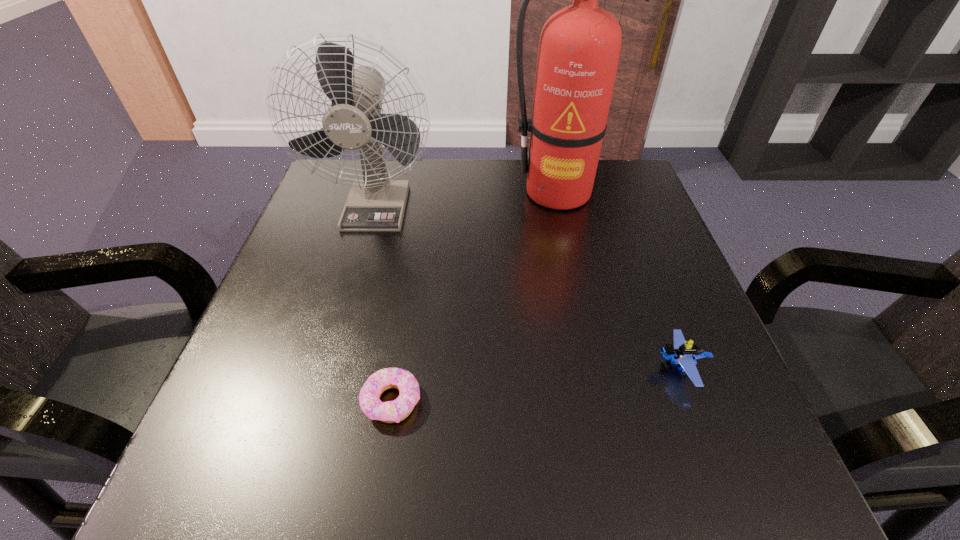
Where is `fire extinguisher`? The image size is (960, 540). fire extinguisher is located at coordinates (579, 48).

Identify the location of fan. This screenshot has height=540, width=960. 354,121.

Locate an element on the screen. This screenshot has width=960, height=540. Lego is located at coordinates (682, 353).

At what (x,y) coordinates should I click in order to perform the action: click on doughnut. Please return your answer as a coordinate pair (x, y). Looking at the image, I should click on (397, 410).

Find the location of a particular element. free spot located on the side of the fire extinguisher with the nozzle and handle is located at coordinates (572, 268).

Where is `vacant area located 0.380m on the air flow direction of the second tallest object`? The height and width of the screenshot is (540, 960). vacant area located 0.380m on the air flow direction of the second tallest object is located at coordinates (328, 382).

Where is `free region located on the front-facing side of the third tallest object`? free region located on the front-facing side of the third tallest object is located at coordinates (421, 367).

Where is `vacant space located 0.380m on the front-facing side of the third tallest object`? Image resolution: width=960 pixels, height=540 pixels. vacant space located 0.380m on the front-facing side of the third tallest object is located at coordinates (427, 367).

Identify the location of free space located on the front-facing side of the third tallest object. (x=416, y=367).

Where is `free location located 0.220m on the left of the shortest object`? free location located 0.220m on the left of the shortest object is located at coordinates (223, 401).